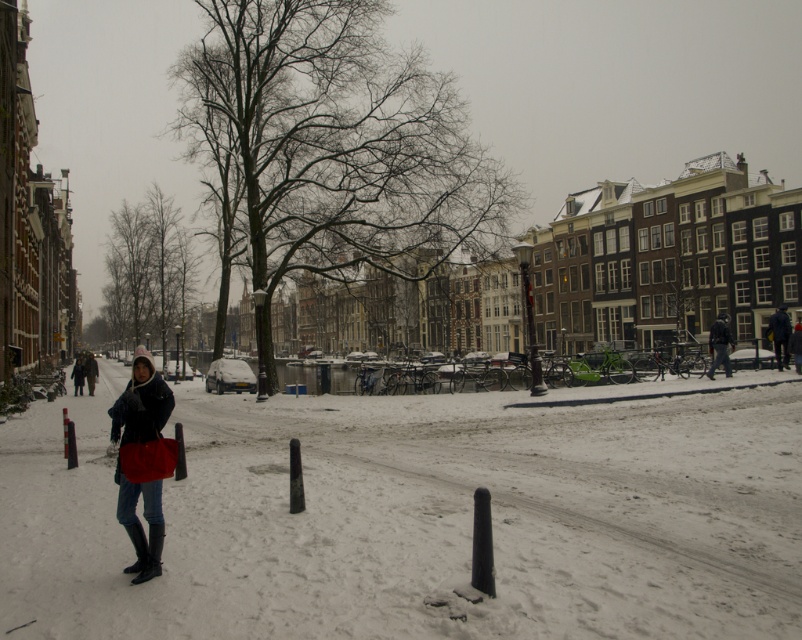
You are a delivery robot with a 2.5 meter wide package. You need to move from the snow at center to the delivery point near the canal. Can you navigate through the path between the white matte snow at center and the dark blue jacket at center?

The distance between the white matte snow at center and the dark blue jacket at center is 23.36 meters. Since the package is only 2.5 meters wide, the robot can easily navigate through the path as the distance is more than sufficient to accommodate the package.

You are a delivery person trying to navigate through the snowy street. You notice the white matte snow at center and the dark gray fabric jacket at right. Which object is lower in height?

The white matte snow at center is shorter than the dark gray fabric jacket at right, so the white matte snow at center is lower in height.

You are standing in the snowy urban scene and want to take a photo of the dark blue jacket at center without the white matte snow at center appearing in the foreground. Is this possible?

The white matte snow at center is closer to the viewer than the dark blue jacket at center. To avoid the snow in the foreground, you would need to adjust your position or angle so that the snow is not between you and the jacket.